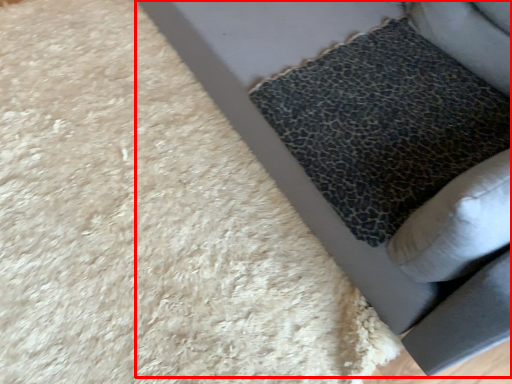
Question: From the image's perspective, where is furniture (annotated by the red box) located relative to pillow?

Choices:
 (A) below
 (B) above

Answer: (B)